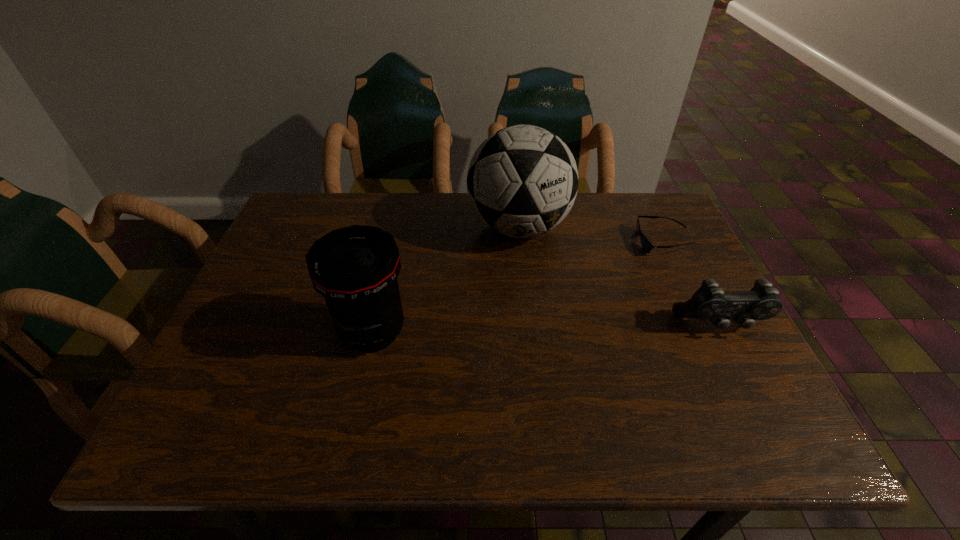
Find the location of `empty location between the control and the leftmost object`. empty location between the control and the leftmost object is located at coordinates click(546, 328).

At what (x,y) coordinates should I click in order to perform the action: click on vacant area that lies between the shortest object and the telephoto lens. Please return your answer as a coordinate pair (x, y). Looking at the image, I should click on (517, 287).

I want to click on free area in between the control and the tallest object, so click(619, 276).

This screenshot has height=540, width=960. I want to click on free point between the control and the third object from right to left, so 619,276.

You are a GUI agent. You are given a task and a screenshot of the screen. Output one action in this format:
    pyautogui.click(x=<x>, y=<y>)
    Task: Click on the unoccupied position between the second shortest object and the third shortest object
    This screenshot has width=960, height=540.
    Given the screenshot: What is the action you would take?
    pyautogui.click(x=546, y=328)

Choose which object is the second nearest neighbor to the tallest object. Please provide its 2D coordinates. Your answer should be formatted as a tuple, i.e. [(x, y)], where the tuple contains the x and y coordinates of a point satisfying the conditions above.

[(355, 268)]

This screenshot has height=540, width=960. I want to click on the closest object to the third tallest object, so click(646, 245).

I want to click on vacant position in the image that satisfies the following two spatial constraints: 1. on the back side of the telephoto lens; 2. on the right side of the sunglasses, so click(x=393, y=242).

Locate an element on the screen. vacant point that satisfies the following two spatial constraints: 1. on the back side of the soccer ball; 2. on the left side of the leftmost object is located at coordinates (396, 227).